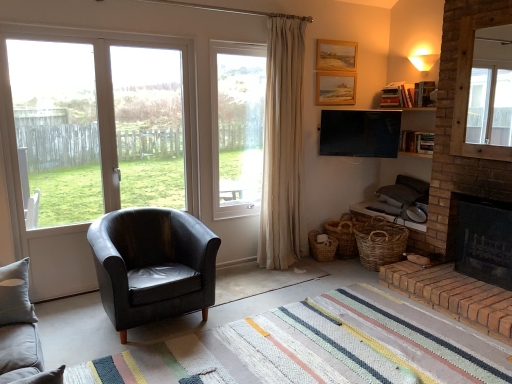
Question: Would you say clear glass window at center, marked as the 2th window in a left-to-right arrangement, is to the left or to the right of transparent glass door at left, which is counted as the first window screen, starting from the left, in the picture?

Choices:
 (A) left
 (B) right

Answer: (B)

Question: Considering the positions of point (251, 102) and point (50, 198), is point (251, 102) closer or farther from the camera than point (50, 198)?

Choices:
 (A) closer
 (B) farther

Answer: (B)

Question: Which of these objects is positioned closest to the woven brown baskets at lower right, which appears as the second basket when viewed from the left?

Choices:
 (A) rug at center
 (B) woven brown basket at lower right, which is the first basket from left to right
 (C) transparent glass window at left, which ranks as the second window in right-to-left order
 (D) beige fabric curtain at upper center
 (E) clear glass window at center, marked as the 2th window in a left-to-right arrangement

Answer: (B)

Question: Estimate the real-world distances between objects in this image. Which object is farther from the black leather armchair at center?

Choices:
 (A) beige fabric curtain at upper center
 (B) clear glass window at center, marked as the 2th window in a left-to-right arrangement
 (C) woven brown baskets at lower right, which appears as the second basket when viewed from the left
 (D) rug at center
 (E) transparent glass door at left, which is counted as the first window screen, starting from the left

Answer: (C)